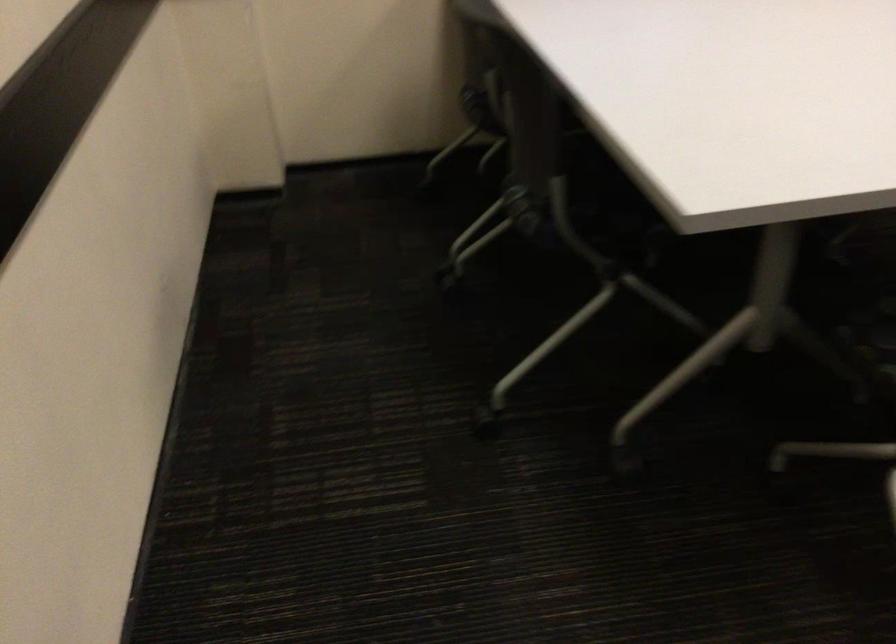
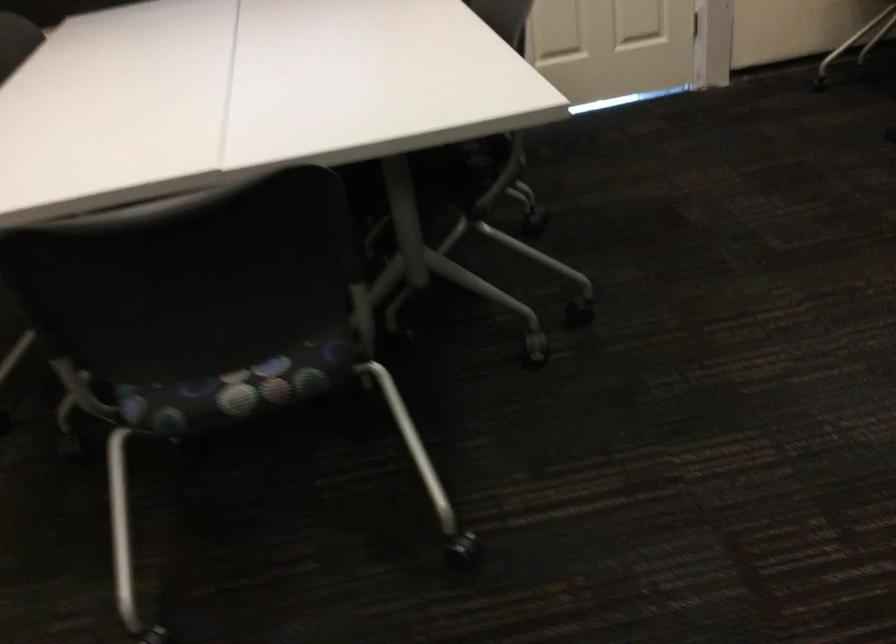
Question: Which direction would the cameraman need to move to produce the second image? Reply with the corresponding letter.

Choices:
 (A) Left
 (B) Right
 (C) Forward
 (D) Backward

Answer: (B)